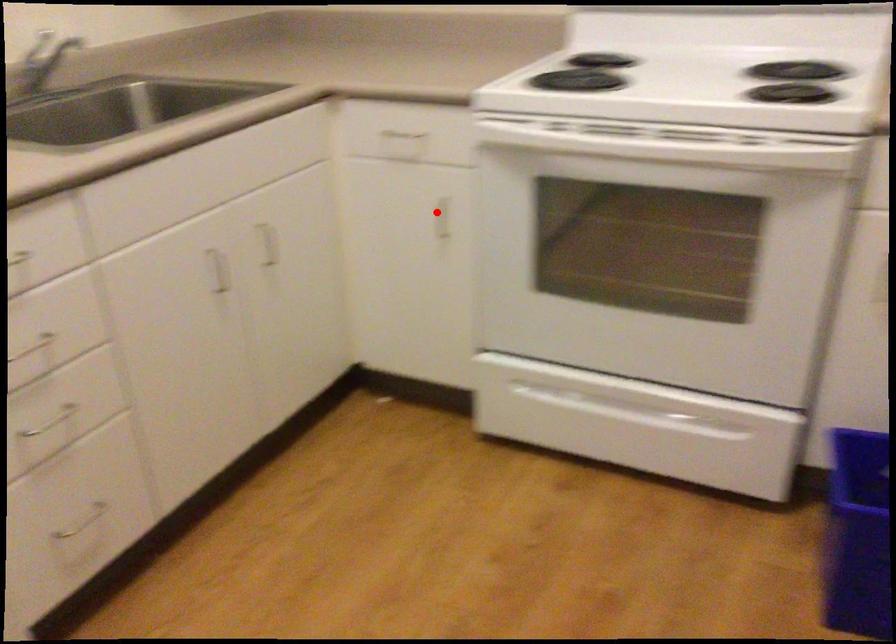
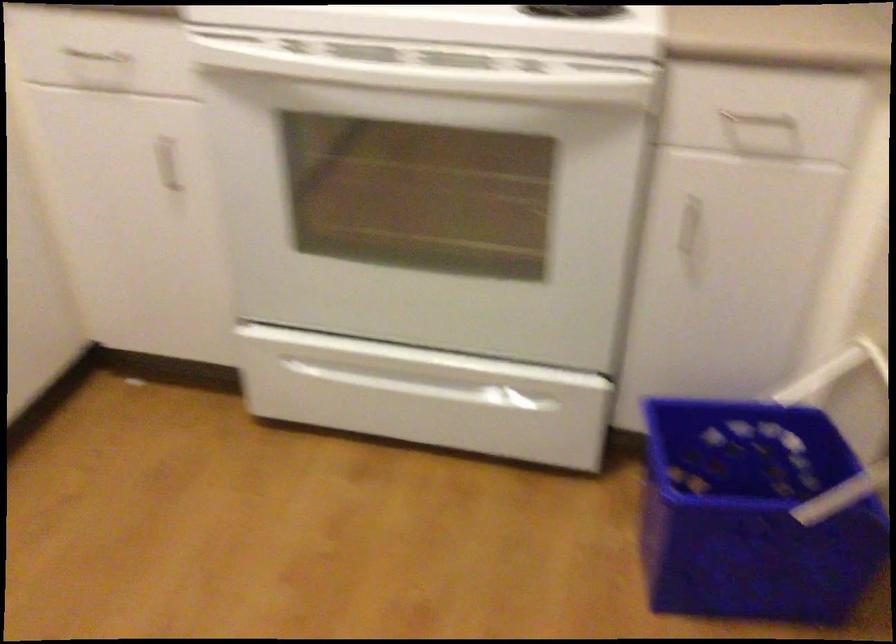
Locate, in the second image, the point that corresponds to the highlighted location in the first image.

(167, 164)